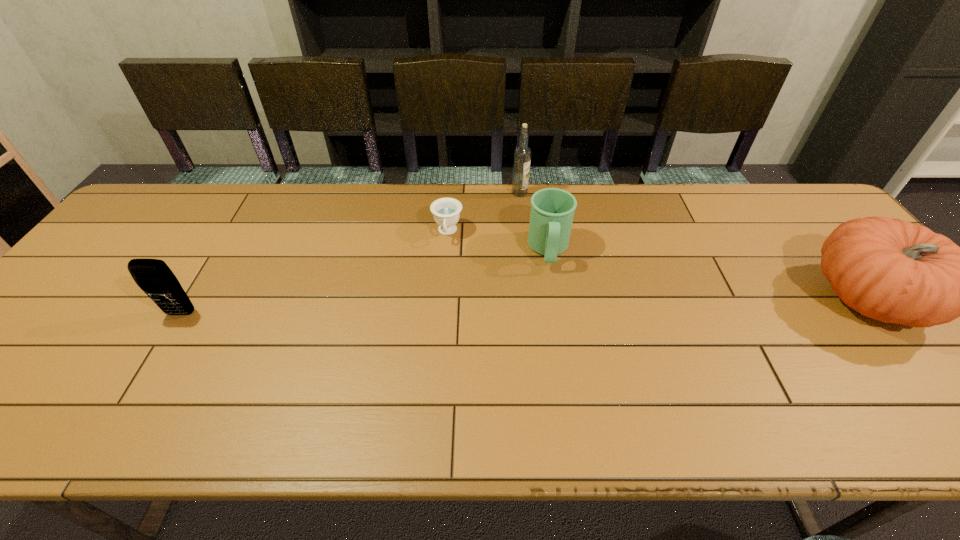
Where is `cellular telephone`? cellular telephone is located at coordinates (153, 276).

Locate an element on the screen. This screenshot has width=960, height=540. the tallest object is located at coordinates (522, 155).

Find the location of `vodka`. vodka is located at coordinates (522, 155).

Image resolution: width=960 pixels, height=540 pixels. Identify the location of mug. (552, 210).

In order to click on the fourth object from right to left in this screenshot , I will do `click(446, 211)`.

Where is `teacup`? teacup is located at coordinates (446, 211).

Image resolution: width=960 pixels, height=540 pixels. Identify the location of vacant area located 0.050m on the screen of the leftmost object. (167, 336).

Where is `vacant space situated on the label of the vodka`? The height and width of the screenshot is (540, 960). vacant space situated on the label of the vodka is located at coordinates (575, 258).

I want to click on free space located 0.360m on the label of the vodka, so click(585, 270).

Where is `free space located on the label of the vodka`? The image size is (960, 540). free space located on the label of the vodka is located at coordinates (562, 243).